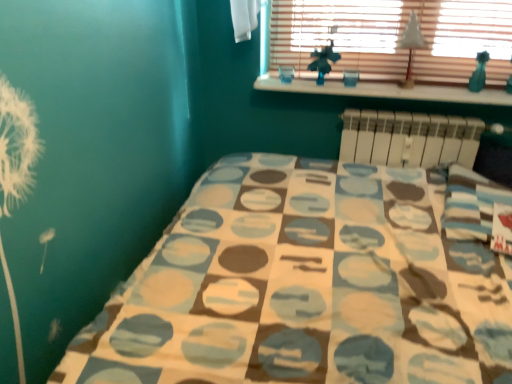
Question: Should I look upward or downward to see white plastic radiator at upper right?

Choices:
 (A) down
 (B) up

Answer: (B)

Question: Does white paper at upper center have a lesser width compared to white wood at upper center?

Choices:
 (A) no
 (B) yes

Answer: (B)

Question: Is white paper at upper center positioned in front of white wood at upper center?

Choices:
 (A) yes
 (B) no

Answer: (A)

Question: Does white paper at upper center appear on the right side of white wood at upper center?

Choices:
 (A) no
 (B) yes

Answer: (B)

Question: Is white paper at upper center to the left of white wood at upper center from the viewer's perspective?

Choices:
 (A) no
 (B) yes

Answer: (A)

Question: Is white paper at upper center facing towards white wood at upper center?

Choices:
 (A) yes
 (B) no

Answer: (B)

Question: Is white paper at upper center positioned beyond the bounds of white wood at upper center?

Choices:
 (A) yes
 (B) no

Answer: (A)

Question: Are wooden blinds at upper center and white wood at upper center beside each other?

Choices:
 (A) yes
 (B) no

Answer: (B)

Question: Is wooden blinds at upper center at the right side of white wood at upper center?

Choices:
 (A) yes
 (B) no

Answer: (A)

Question: Could you tell me if wooden blinds at upper center is facing white wood at upper center?

Choices:
 (A) yes
 (B) no

Answer: (A)

Question: From the image's perspective, does wooden blinds at upper center appear higher than white wood at upper center?

Choices:
 (A) yes
 (B) no

Answer: (A)

Question: Can white wood at upper center be found inside wooden blinds at upper center?

Choices:
 (A) yes
 (B) no

Answer: (B)

Question: Considering the relative sizes of wooden blinds at upper center and white wood at upper center in the image provided, is wooden blinds at upper center smaller than white wood at upper center?

Choices:
 (A) yes
 (B) no

Answer: (B)

Question: Considering the relative sizes of wooden blinds at upper center and white paper at upper center in the image provided, is wooden blinds at upper center wider than white paper at upper center?

Choices:
 (A) yes
 (B) no

Answer: (B)